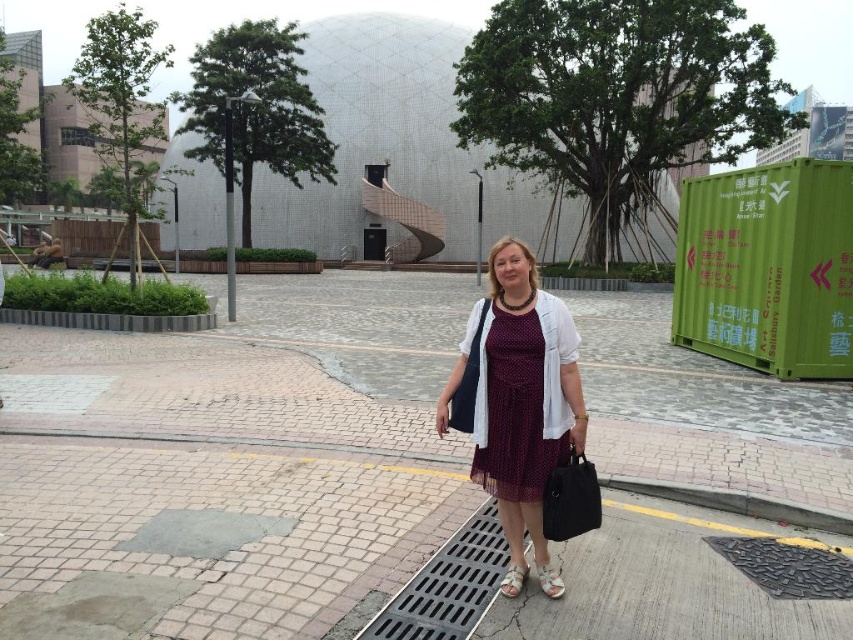
Between burgundy dotted dress at center and white textured sandal at lower center, which one is positioned lower?

white textured sandal at lower center

Does burgundy dotted dress at center have a lesser height compared to white textured sandal at lower center?

Incorrect, burgundy dotted dress at center's height does not fall short of white textured sandal at lower center's.

At what (x,y) coordinates should I click in order to perform the action: click on burgundy dotted dress at center. Please return your answer as a coordinate pair (x, y). Looking at the image, I should click on (517, 392).

Is burgundy tulle dress at center to the right of white fabric sandal at lower center from the viewer's perspective?

Correct, you'll find burgundy tulle dress at center to the right of white fabric sandal at lower center.

What do you see at coordinates (521, 401) in the screenshot? I see `burgundy tulle dress at center` at bounding box center [521, 401].

Locate an element on the screen. This screenshot has width=853, height=640. burgundy tulle dress at center is located at coordinates (521, 401).

Where is `burgundy tulle dress at center`? The height and width of the screenshot is (640, 853). burgundy tulle dress at center is located at coordinates (521, 401).

Is burgundy tulle dress at center bigger than white textured sandal at lower center?

Yes, burgundy tulle dress at center is bigger than white textured sandal at lower center.

Between point (511, 337) and point (547, 588), which one is positioned behind?

Positioned behind is point (547, 588).

Is point (560, 412) farther from viewer compared to point (556, 582)?

No, (560, 412) is in front of (556, 582).

Find the location of a particular element. Image resolution: width=853 pixels, height=640 pixels. burgundy tulle dress at center is located at coordinates (521, 401).